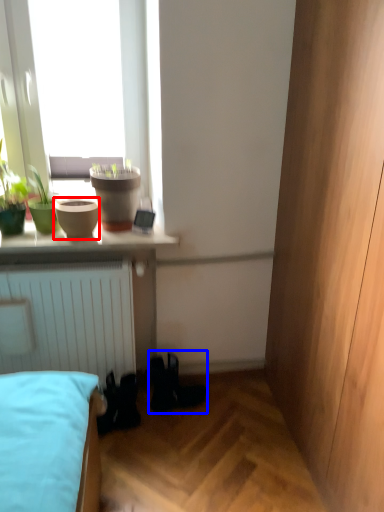
Question: Among these objects, which one is nearest to the camera, flowerpot (highlighted by a red box) or shoe (highlighted by a blue box)?

Choices:
 (A) flowerpot
 (B) shoe

Answer: (A)